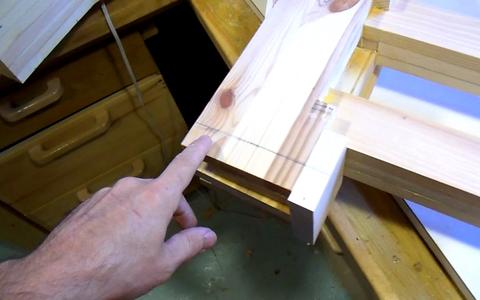
The image size is (480, 300). In order to click on floor in this screenshot , I will do `click(240, 261)`.